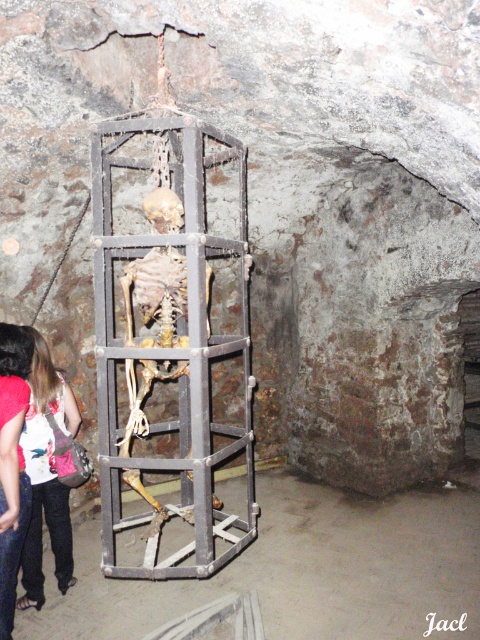
Is wooden cage at center below denim jacket at lower left?

Correct, wooden cage at center is located below denim jacket at lower left.

Which is in front, point (384, 616) or point (6, 586)?

Point (6, 586) is in front.

Where is `wooden cage at center`? The image size is (480, 640). wooden cage at center is located at coordinates (300, 570).

Who is shorter, rusty metal cage at center or wooden cage at center?

wooden cage at center

Is point (137, 170) positioned before point (69, 595)?

No.

Locate an element on the screen. The width and height of the screenshot is (480, 640). rusty metal cage at center is located at coordinates (168, 332).

What are the coordinates of `wooden cage at center` in the screenshot? It's located at (300, 570).

Does point (354, 577) lie in front of point (49, 465)?

That is False.

Find the location of a particular element. This screenshot has height=640, width=480. wooden cage at center is located at coordinates (300, 570).